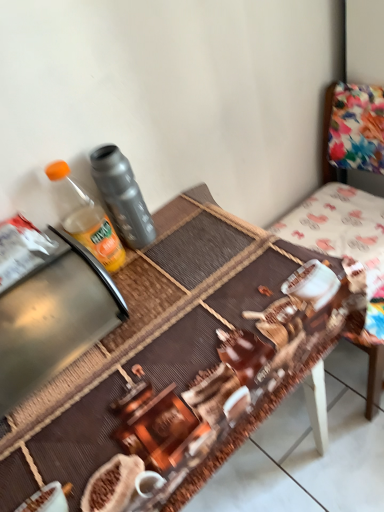
Locate an element on the screen. This screenshot has height=512, width=384. free spot to the right of matte gray thermos at left, the 1th bottle viewed from the right is located at coordinates (195, 222).